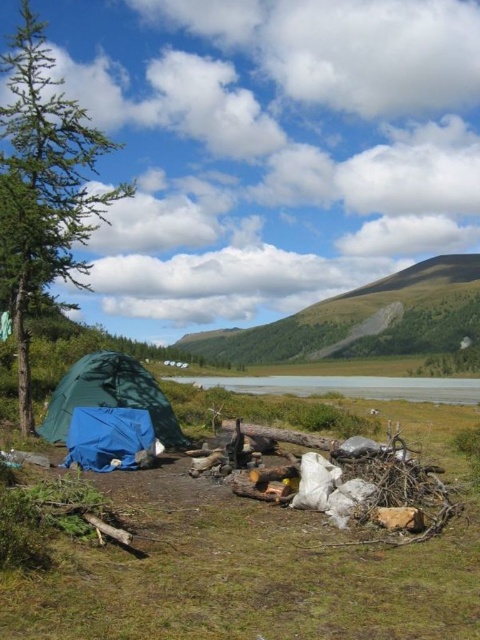
Question: Can you confirm if green fabric tent at center is positioned to the right of transparent blue water at center?

Choices:
 (A) no
 (B) yes

Answer: (A)

Question: Estimate the real-world distances between objects in this image. Which object is closer to the blue tarp at lower left?

Choices:
 (A) green fabric tent at center
 (B) transparent blue water at center

Answer: (A)

Question: Observing the image, what is the correct spatial positioning of transparent blue water at center in reference to blue tarp at lower left?

Choices:
 (A) below
 (B) above

Answer: (A)

Question: Which point is farther from the camera taking this photo?

Choices:
 (A) (448, 378)
 (B) (149, 426)

Answer: (A)

Question: Estimate the real-world distances between objects in this image. Which object is farther from the blue tarp at lower left?

Choices:
 (A) green fabric tent at center
 (B) transparent blue water at center

Answer: (B)

Question: Can you confirm if green fabric tent at center is positioned below transparent blue water at center?

Choices:
 (A) no
 (B) yes

Answer: (A)